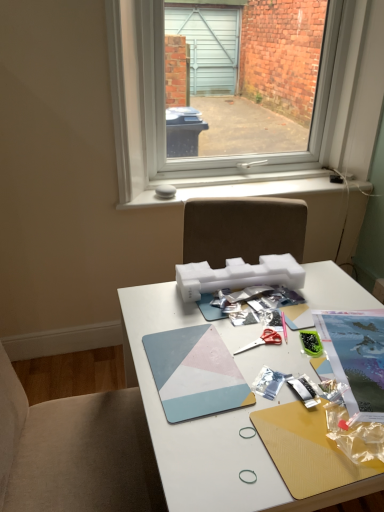
This screenshot has height=512, width=384. I want to click on free area in between geometric matte mousepad at center, positioned as the first magazine in left-to-right order, and green plastic container at center-right, so click(263, 352).